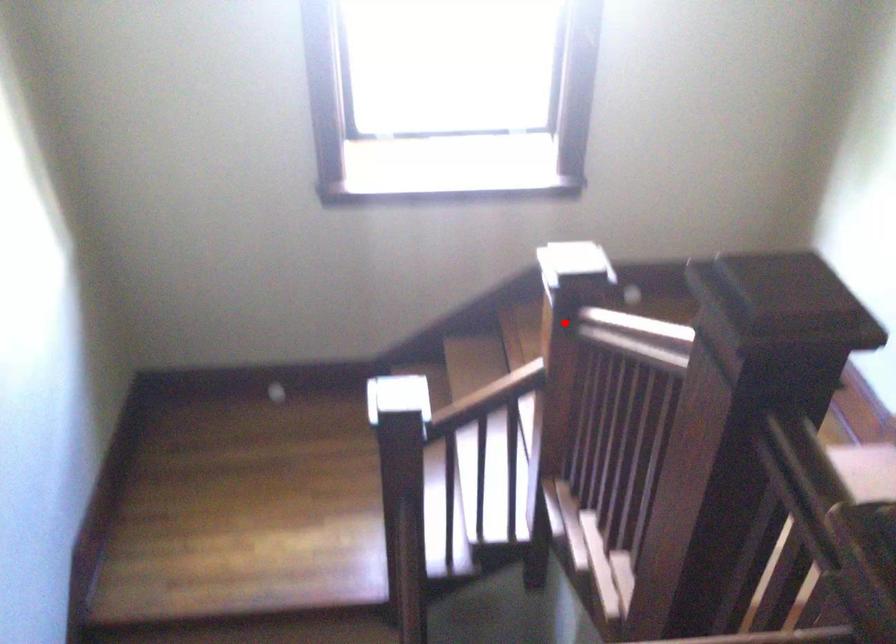
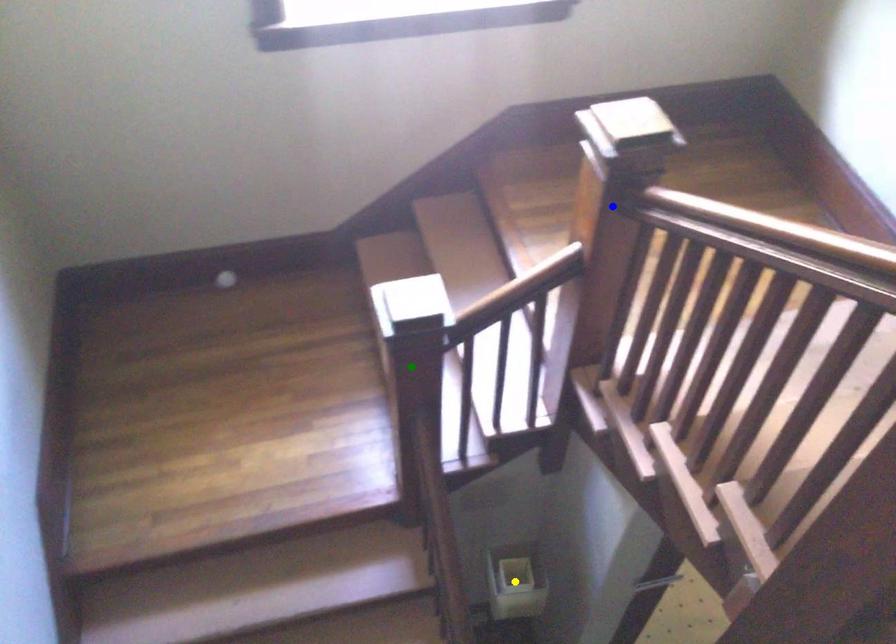
Question: I am providing you with two images of the same scene from different viewpoints. A red point is marked on the first image. You are given multiple points on the second image. Which point in image 2 is actually the same real-world point as the red point in image 1?

Choices:
 (A) blue point
 (B) yellow point
 (C) green point

Answer: (A)